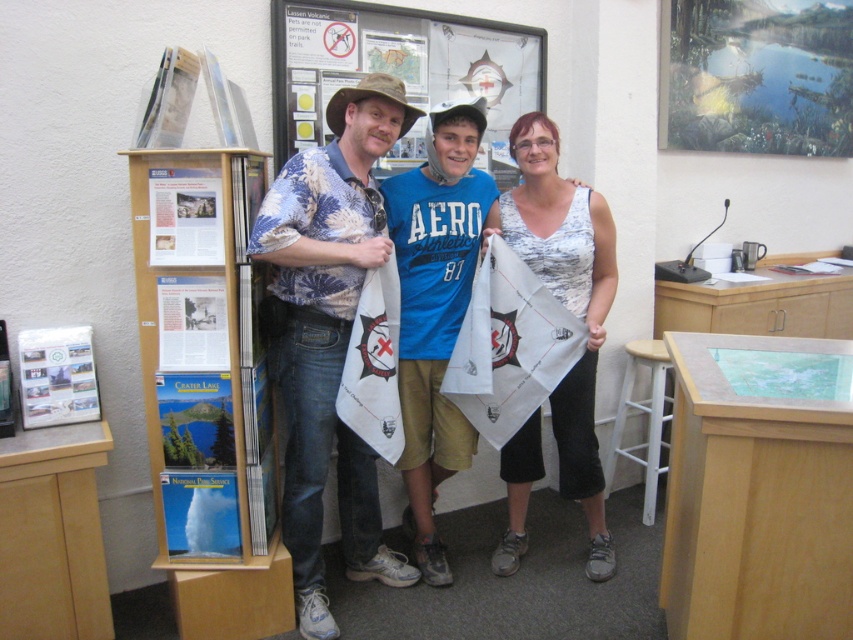
Does blue cotton t-shirt at center have a greater width compared to white paper at left?

Yes, blue cotton t-shirt at center is wider than white paper at left.

Is blue cotton t-shirt at center thinner than white paper at left?

No, blue cotton t-shirt at center is not thinner than white paper at left.

Who is more distant from viewer, (450, 188) or (158, 243)?

Point (450, 188)

This screenshot has width=853, height=640. Find the location of `blue cotton t-shirt at center`. blue cotton t-shirt at center is located at coordinates (434, 308).

From the picture: Is the position of white textured tank top at center less distant than that of matte paper poster at left?

No, white textured tank top at center is behind matte paper poster at left.

Who is shorter, white textured tank top at center or matte paper poster at left?

matte paper poster at left is shorter.

Is point (596, 534) less distant than point (93, 384)?

That is False.

At what (x,y) coordinates should I click in order to perform the action: click on white textured tank top at center. Please return your answer as a coordinate pair (x, y). This screenshot has width=853, height=640. Looking at the image, I should click on (566, 304).

Which is more to the left, floral shirt at center or white paper at center?

From the viewer's perspective, white paper at center appears more on the left side.

Can you confirm if floral shirt at center is wider than white paper at center?

Correct, the width of floral shirt at center exceeds that of white paper at center.

Is point (311, 467) farther from viewer compared to point (184, 336)?

Yes, it is behind point (184, 336).

What are the coordinates of `floral shirt at center` in the screenshot? It's located at (328, 333).